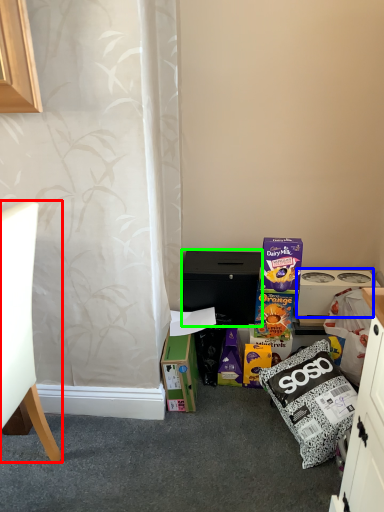
Question: Which object is the closest to the chair (highlighted by a red box)? Choose among these: appliance (highlighted by a blue box) or cabinetry (highlighted by a green box).

Choices:
 (A) appliance
 (B) cabinetry

Answer: (B)